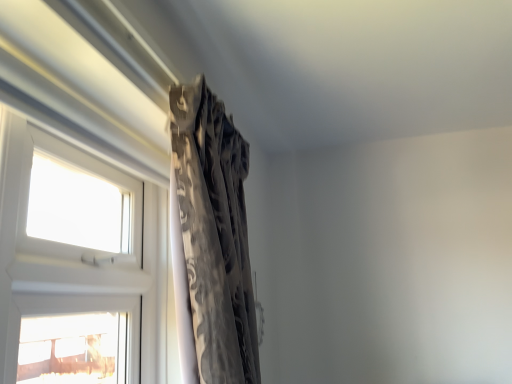
Identify the location of textured gray curtain at center. This screenshot has width=512, height=384. (214, 234).

The width and height of the screenshot is (512, 384). What do you see at coordinates (214, 234) in the screenshot?
I see `textured gray curtain at center` at bounding box center [214, 234].

What is the approximate height of textured gray curtain at center?

It is 31.02 inches.

Where is `textured gray curtain at center`? textured gray curtain at center is located at coordinates pyautogui.click(x=214, y=234).